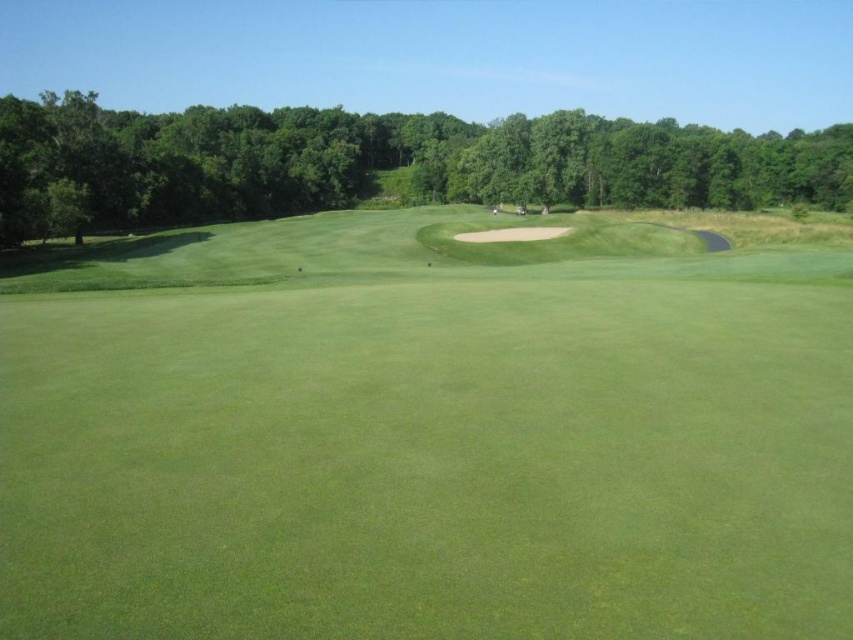
You are a golfer trying to determine the best path for your ball. Considering the green grassy fairway at center and the green leafy tree at upper center, which of these two features takes up more area in the image?

The green leafy tree at upper center occupies more space than the green grassy fairway at center in the image.

You are a golfer standing on the green grassy fairway at center. You want to hit the ball towards the green leafy tree at upper center. Will the ball roll towards the tree or away from it based on the slope of the fairway?

The green grassy fairway at center is below the green leafy tree at upper center, so the ball will roll towards the tree because the fairway slopes upward in that direction.